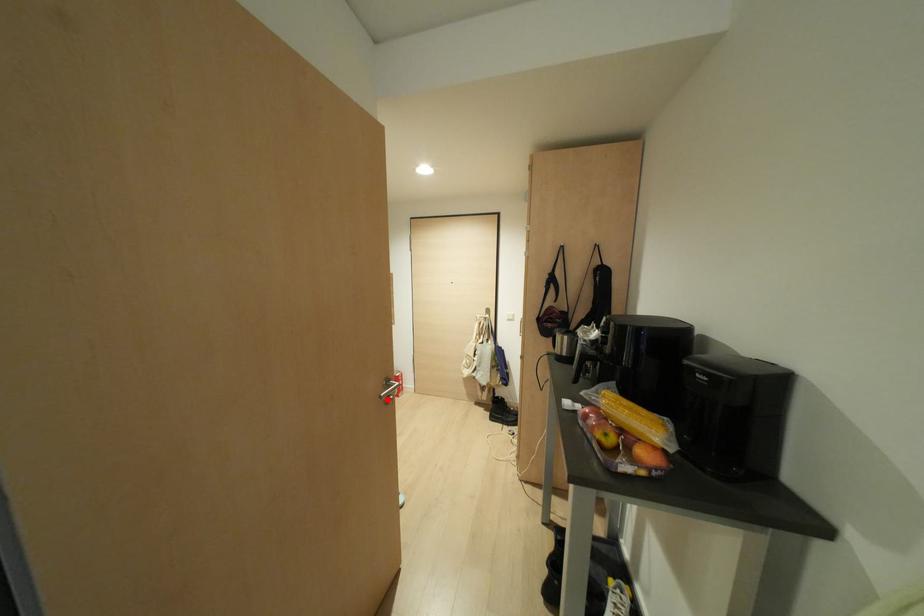
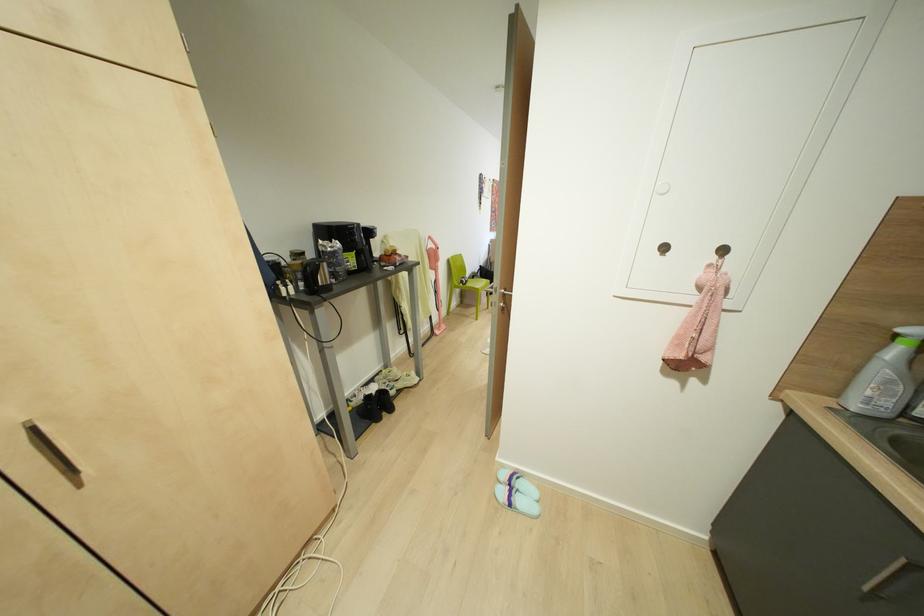
Question: I am providing you with two images of the same scene from different viewpoints. A red point is marked on the first image. Can you still see the location of the red point in image 2?

Choices:
 (A) Yes
 (B) No

Answer: (B)